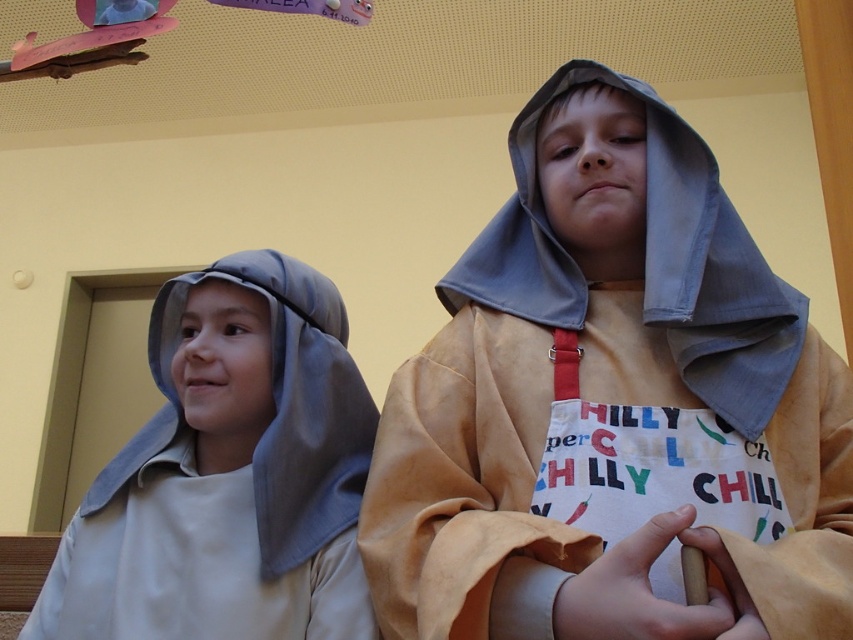
From the picture: You are a costume designer looking at the image. You need to determine the spatial relationship between the light brown leather robe at center and the matte gray hood at left. Which object is positioned higher in the image?

The light brown leather robe at center is located above the matte gray hood at left, so it is positioned higher in the image.

You are standing in a classroom and see the light brown leather robe at center. If you move 0.1 units to the right and 0.1 units up from your current position, will you be closer to the robe?

Moving 0.1 units to the right and 0.1 units up from your current position would place you at point (698, 470). The robe is at point (612, 406). The distance between the new position and the robe is sqrt of the squared differences in coordinates, which is sqrt of 0.1 squared plus 0.1 squared, which is sqrt of 0.02, approximately 0.1414 units. The original distance was sqrt of 0 squared plus 0 squared, which is 0 units. Wait, but the original position is not given. Hmm, maybe the question is flawed. The

You are standing in a classroom and see the light brown leather robe at center and the matte gray hood at left. Which object is nearer to you?

The light brown leather robe at center is closer to the viewer than the matte gray hood at left.